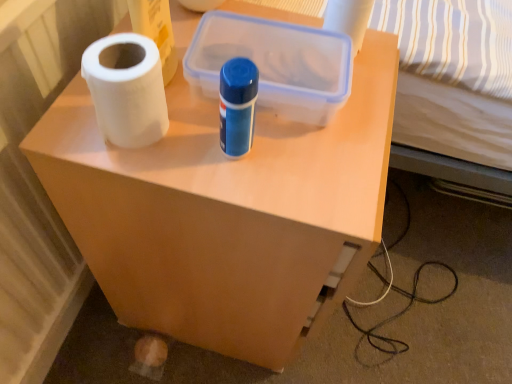
Question: Can we say matte plastic side table at center lies outside transparent plastic storage box at center?

Choices:
 (A) no
 (B) yes

Answer: (B)

Question: Can you confirm if matte plastic side table at center is shorter than transparent plastic storage box at center?

Choices:
 (A) no
 (B) yes

Answer: (A)

Question: From a real-world perspective, is matte plastic side table at center beneath transparent plastic storage box at center?

Choices:
 (A) no
 (B) yes

Answer: (B)

Question: Is matte plastic side table at center positioned far away from transparent plastic storage box at center?

Choices:
 (A) yes
 (B) no

Answer: (B)

Question: Is matte plastic side table at center bigger than transparent plastic storage box at center?

Choices:
 (A) no
 (B) yes

Answer: (B)

Question: Looking at their shapes, would you say white matte paper towel at left is wider or thinner than matte plastic side table at center?

Choices:
 (A) wide
 (B) thin

Answer: (B)

Question: Based on their sizes in the image, would you say white matte paper towel at left is bigger or smaller than matte plastic side table at center?

Choices:
 (A) small
 (B) big

Answer: (A)

Question: Is white matte paper towel at left in front of or behind matte plastic side table at center in the image?

Choices:
 (A) front
 (B) behind

Answer: (A)

Question: Considering the positions of white matte paper towel at left and matte plastic side table at center in the image, is white matte paper towel at left taller or shorter than matte plastic side table at center?

Choices:
 (A) short
 (B) tall

Answer: (A)

Question: From a real-world perspective, is white matte toilet paper at upper center positioned above or below matte plastic side table at center?

Choices:
 (A) below
 (B) above

Answer: (B)

Question: Looking at their shapes, would you say white matte toilet paper at upper center is wider or thinner than matte plastic side table at center?

Choices:
 (A) thin
 (B) wide

Answer: (A)

Question: Which is correct: white matte toilet paper at upper center is inside matte plastic side table at center, or outside of it?

Choices:
 (A) outside
 (B) inside

Answer: (A)

Question: From the image's perspective, is white matte toilet paper at upper center located above or below matte plastic side table at center?

Choices:
 (A) below
 (B) above

Answer: (B)

Question: From the image's perspective, is transparent plastic storage box at center above or below white matte toilet paper at upper center?

Choices:
 (A) above
 (B) below

Answer: (B)

Question: Which is correct: transparent plastic storage box at center is inside white matte toilet paper at upper center, or outside of it?

Choices:
 (A) outside
 (B) inside

Answer: (A)